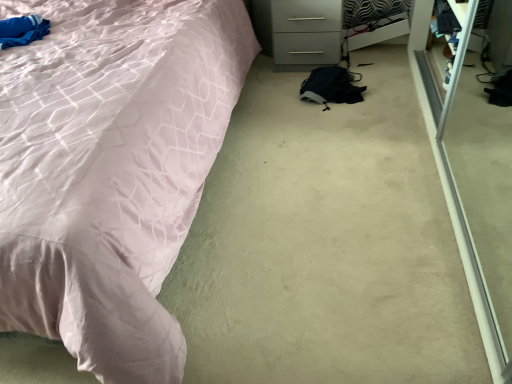
I want to click on white glossy drawer at upper right, so click(x=306, y=31).

This screenshot has width=512, height=384. Describe the element at coordinates (306, 31) in the screenshot. I see `white glossy drawer at upper right` at that location.

What do you see at coordinates (111, 170) in the screenshot?
I see `matte pink fabric bed at left` at bounding box center [111, 170].

What are the coordinates of `matte pink fabric bed at left` in the screenshot? It's located at (111, 170).

This screenshot has width=512, height=384. I want to click on white glossy drawer at upper right, so click(x=306, y=31).

Does matte pink fabric bed at left appear on the left side of white glossy drawer at upper right?

Yes.

Considering the relative positions of matte pink fabric bed at left and white glossy drawer at upper right in the image provided, is matte pink fabric bed at left in front of white glossy drawer at upper right?

Yes, the depth of matte pink fabric bed at left is less than that of white glossy drawer at upper right.

Is point (191, 186) farther from viewer compared to point (296, 44)?

No, it is in front of (296, 44).

In the scene shown: From the image's perspective, is matte pink fabric bed at left under white glossy drawer at upper right?

Yes.

From a real-world perspective, does matte pink fabric bed at left sit lower than white glossy drawer at upper right?

Actually, matte pink fabric bed at left is physically above white glossy drawer at upper right in the real world.

Which of these two, matte pink fabric bed at left or white glossy drawer at upper right, is thinner?

white glossy drawer at upper right.

Is matte pink fabric bed at left taller than white glossy drawer at upper right?

Indeed, matte pink fabric bed at left has a greater height compared to white glossy drawer at upper right.

Considering the sizes of matte pink fabric bed at left and white glossy drawer at upper right in the image, is matte pink fabric bed at left bigger or smaller than white glossy drawer at upper right?

In the image, matte pink fabric bed at left appears to be larger than white glossy drawer at upper right.

From the picture: Which is correct: matte pink fabric bed at left is inside white glossy drawer at upper right, or outside of it?

matte pink fabric bed at left is located beyond the bounds of white glossy drawer at upper right.

Is matte pink fabric bed at left directly adjacent to white glossy drawer at upper right?

No, matte pink fabric bed at left is not in contact with white glossy drawer at upper right.

Could you tell me if matte pink fabric bed at left is turned towards white glossy drawer at upper right?

No.

Can you tell me how much matte pink fabric bed at left and white glossy drawer at upper right differ in facing direction?

They differ by 0.535 degrees in their facing directions.

How much distance is there between matte pink fabric bed at left and white glossy drawer at upper right?

A distance of 34.28 inches exists between matte pink fabric bed at left and white glossy drawer at upper right.

This screenshot has height=384, width=512. Identify the location of bed in front of the white glossy drawer at upper right. (111, 170).

Is white glossy drawer at upper right to the right of matte pink fabric bed at left from the viewer's perspective?

Yes.

Which object is closer to the camera, white glossy drawer at upper right or matte pink fabric bed at left?

matte pink fabric bed at left is in front.

Which is farther from the camera, (289, 37) or (150, 323)?

Positioned behind is point (289, 37).

From the image's perspective, is white glossy drawer at upper right beneath matte pink fabric bed at left?

Incorrect, from the image's perspective, white glossy drawer at upper right is higher than matte pink fabric bed at left.

From a real-world perspective, which is physically below, white glossy drawer at upper right or matte pink fabric bed at left?

white glossy drawer at upper right is physically lower.

Which object is wider, white glossy drawer at upper right or matte pink fabric bed at left?

matte pink fabric bed at left is wider.

Who is shorter, white glossy drawer at upper right or matte pink fabric bed at left?

white glossy drawer at upper right.

Based on their sizes in the image, would you say white glossy drawer at upper right is bigger or smaller than matte pink fabric bed at left?

In the image, white glossy drawer at upper right appears to be smaller than matte pink fabric bed at left.

Is matte pink fabric bed at left surrounded by white glossy drawer at upper right?

No, matte pink fabric bed at left is not a part of white glossy drawer at upper right.

Are white glossy drawer at upper right and matte pink fabric bed at left beside each other?

white glossy drawer at upper right is not next to matte pink fabric bed at left, and they're not touching.

Is white glossy drawer at upper right looking in the opposite direction of matte pink fabric bed at left?

white glossy drawer at upper right does not have its back to matte pink fabric bed at left.

The height and width of the screenshot is (384, 512). What are the coordinates of `drawer above the matte pink fabric bed at left (from the image's perspective)` in the screenshot? It's located at [x=306, y=31].

Locate an element on the screen. The height and width of the screenshot is (384, 512). bed on the left of white glossy drawer at upper right is located at coordinates (111, 170).

Identify the location of drawer directly beneath the matte pink fabric bed at left (from a real-world perspective). Image resolution: width=512 pixels, height=384 pixels. (306, 31).